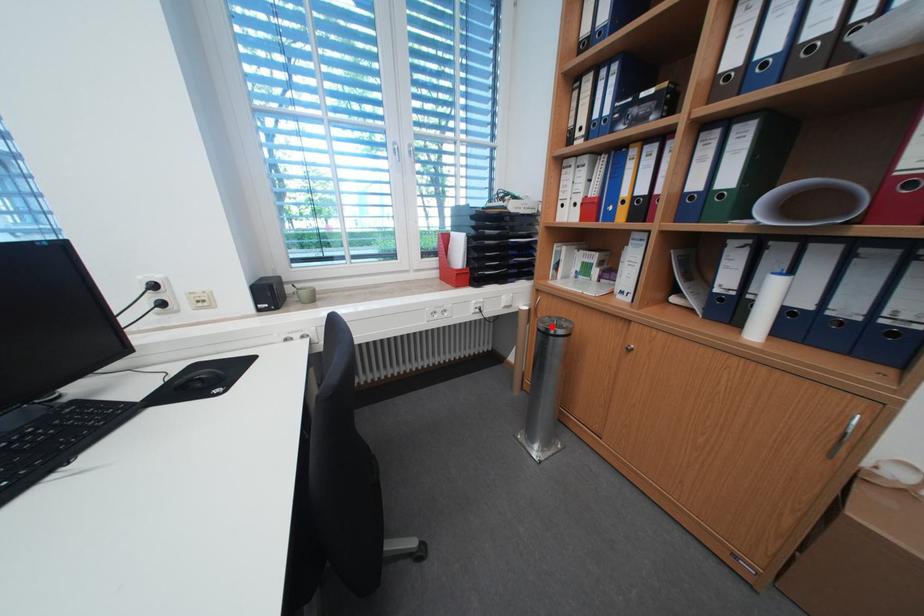
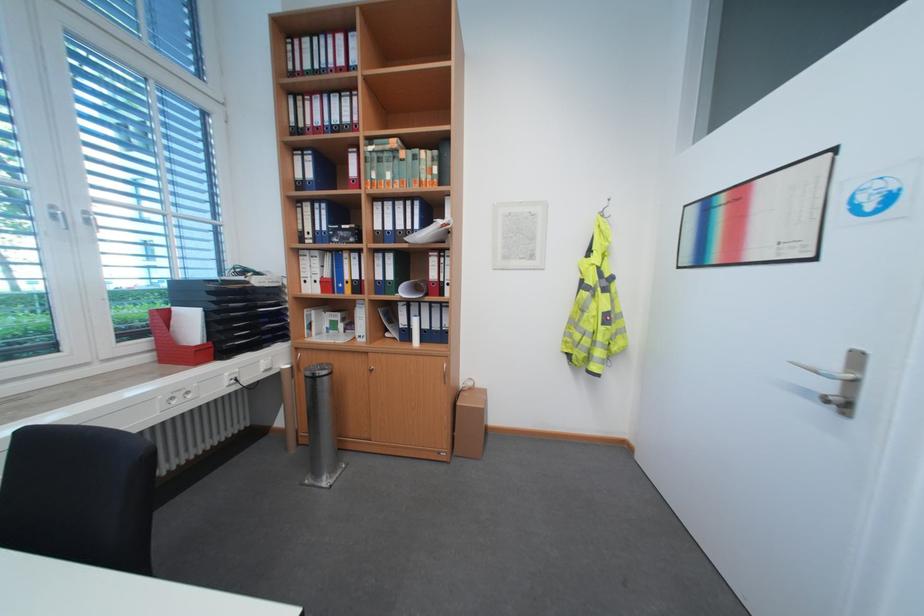
Find the pixel in the second image that matches the highlighted location in the first image.

(319, 374)